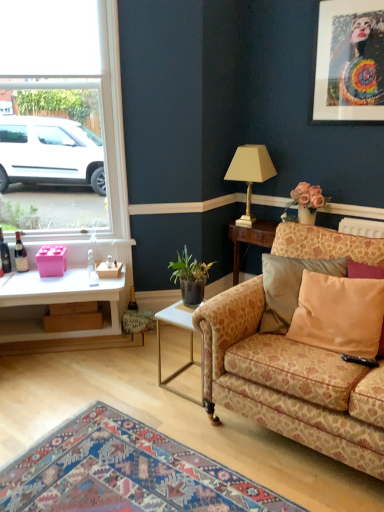
Question: Is brown cardboard box at lower left, the 1th box from the bottom, beside gold metallic lamp at upper center?

Choices:
 (A) no
 (B) yes

Answer: (A)

Question: From the image's perspective, is brown cardboard box at lower left, the 1th box from the bottom, beneath gold metallic lamp at upper center?

Choices:
 (A) yes
 (B) no

Answer: (A)

Question: From the image's perspective, is brown cardboard box at lower left, placed as the 2th box when sorted from top to bottom, located above gold metallic lamp at upper center?

Choices:
 (A) yes
 (B) no

Answer: (B)

Question: Is brown cardboard box at lower left, placed as the 2th box when sorted from top to bottom, closer to the viewer compared to gold metallic lamp at upper center?

Choices:
 (A) yes
 (B) no

Answer: (B)

Question: From a real-world perspective, is brown cardboard box at lower left, placed as the 2th box when sorted from top to bottom, located beneath gold metallic lamp at upper center?

Choices:
 (A) no
 (B) yes

Answer: (B)

Question: Considering the relative positions of white metal side table at lower center and floral-patterned fabric couch at right in the image provided, is white metal side table at lower center in front of floral-patterned fabric couch at right?

Choices:
 (A) yes
 (B) no

Answer: (B)

Question: From a real-world perspective, is white metal side table at lower center positioned over floral-patterned fabric couch at right based on gravity?

Choices:
 (A) yes
 (B) no

Answer: (B)

Question: Is white metal side table at lower center shorter than floral-patterned fabric couch at right?

Choices:
 (A) no
 (B) yes

Answer: (B)

Question: From the image's perspective, is white metal side table at lower center above floral-patterned fabric couch at right?

Choices:
 (A) no
 (B) yes

Answer: (A)

Question: Is white metal side table at lower center to the left of floral-patterned fabric couch at right from the viewer's perspective?

Choices:
 (A) no
 (B) yes

Answer: (B)

Question: Is floral-patterned fabric couch at right at the back of white metal side table at lower center?

Choices:
 (A) no
 (B) yes

Answer: (A)

Question: Is white glass window at upper left turned away from brown cardboard box at lower left, placed as the 2th box when sorted from top to bottom?

Choices:
 (A) no
 (B) yes

Answer: (A)